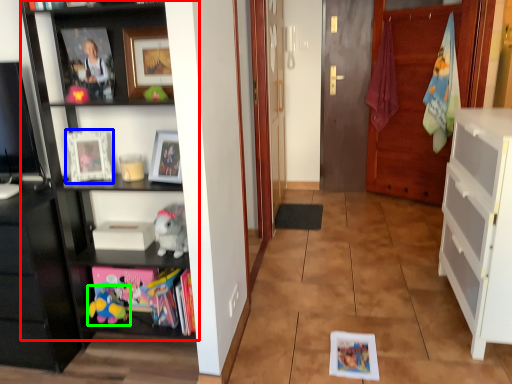
Question: Considering the real-world distances, which object is farthest from shelf (highlighted by a red box)? picture frame (highlighted by a blue box) or toy (highlighted by a green box)?

Choices:
 (A) picture frame
 (B) toy

Answer: (B)